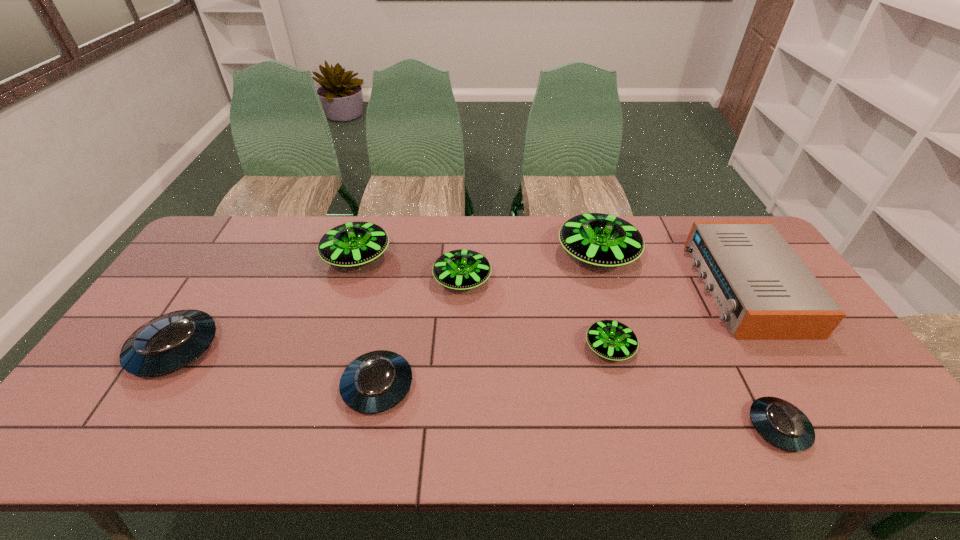
Where is `blank area at the far left corner`? blank area at the far left corner is located at coordinates (203, 251).

At what (x,y) coordinates should I click in order to perform the action: click on empty location between the rightmost saucer and the radio receiver. Please return your answer as a coordinate pair (x, y). Looking at the image, I should click on (761, 357).

The height and width of the screenshot is (540, 960). What are the coordinates of `free spot between the tallest object and the nearest green saucer` in the screenshot? It's located at (604, 301).

The width and height of the screenshot is (960, 540). What are the coordinates of `free spot between the tallest saucer and the nearest green saucer` in the screenshot? It's located at (604, 301).

Find the location of a particular element. blank region between the second biggest gray saucer and the leftmost saucer is located at coordinates (276, 367).

At what (x,y) coordinates should I click in order to perform the action: click on vacant area that lies between the leftmost gray saucer and the nearest green saucer. Please return your answer as a coordinate pair (x, y). This screenshot has width=960, height=540. Looking at the image, I should click on (393, 348).

Image resolution: width=960 pixels, height=540 pixels. What are the coordinates of `free space that is in between the biggest green saucer and the third biggest green saucer` in the screenshot? It's located at (530, 267).

At what (x,y) coordinates should I click in order to perform the action: click on free spot between the radio receiver and the leftmost green saucer. Please return your answer as a coordinate pair (x, y). The height and width of the screenshot is (540, 960). Looking at the image, I should click on (550, 272).

This screenshot has width=960, height=540. I want to click on free space between the second tallest saucer and the biggest gray saucer, so click(x=266, y=302).

Where is `the fifth closest object to the radio receiver`? the fifth closest object to the radio receiver is located at coordinates (376, 381).